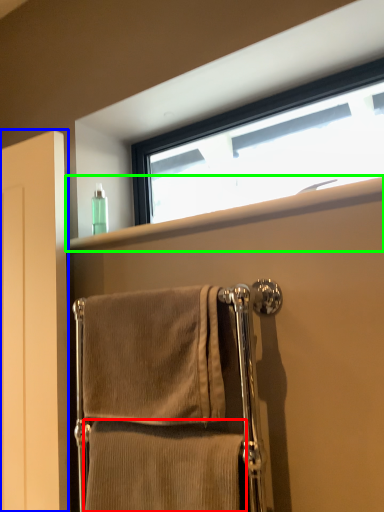
Question: Estimate the real-world distances between objects in this image. Which object is closer to towel (highlighted by a red box), screen door (highlighted by a blue box) or window sill (highlighted by a green box)?

Choices:
 (A) screen door
 (B) window sill

Answer: (A)